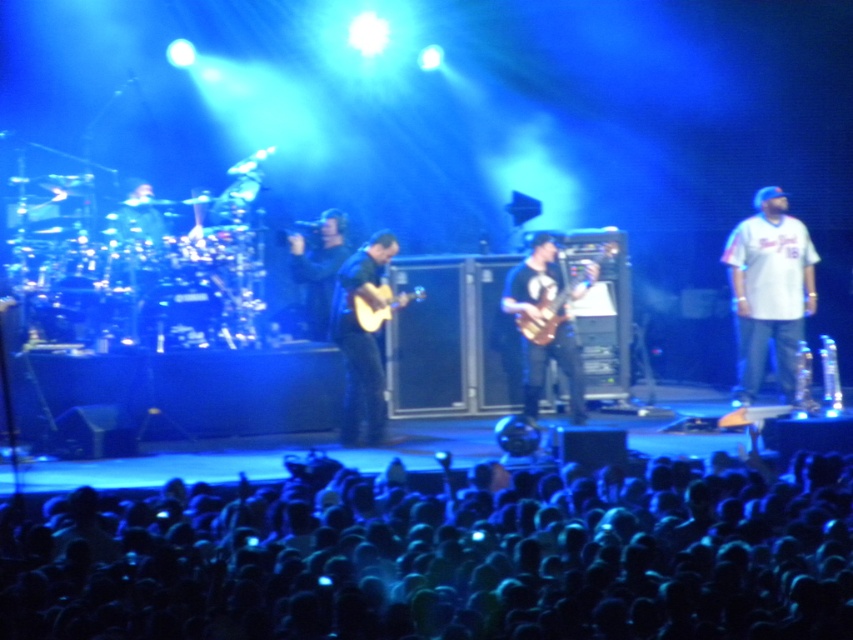
Can you confirm if white cotton shirt at right is wider than matte black guitar at center?

Indeed, white cotton shirt at right has a greater width compared to matte black guitar at center.

Does white cotton shirt at right have a greater height compared to matte black guitar at center?

Yes, white cotton shirt at right is taller than matte black guitar at center.

Between point (809, 244) and point (531, 388), which one is positioned in front?

Point (531, 388) is in front.

Where is `white cotton shirt at right`? The width and height of the screenshot is (853, 640). white cotton shirt at right is located at coordinates (769, 291).

Can you confirm if black fabric crowd at lower center is smaller than matte black guitar at center?

No.

Measure the distance between black fabric crowd at lower center and matte black guitar at center.

black fabric crowd at lower center is 11.53 feet from matte black guitar at center.

Image resolution: width=853 pixels, height=640 pixels. In order to click on black fabric crowd at lower center in this screenshot , I will do `click(457, 566)`.

Where is `black fabric crowd at lower center`? Image resolution: width=853 pixels, height=640 pixels. black fabric crowd at lower center is located at coordinates (457, 566).

Is point (314, 300) farther from camera compared to point (524, 316)?

That is True.

Does black matte jacket at center appear on the left side of shiny brown electric guitar at center?

Indeed, black matte jacket at center is positioned on the left side of shiny brown electric guitar at center.

This screenshot has width=853, height=640. What are the coordinates of `black matte jacket at center` in the screenshot? It's located at (318, 268).